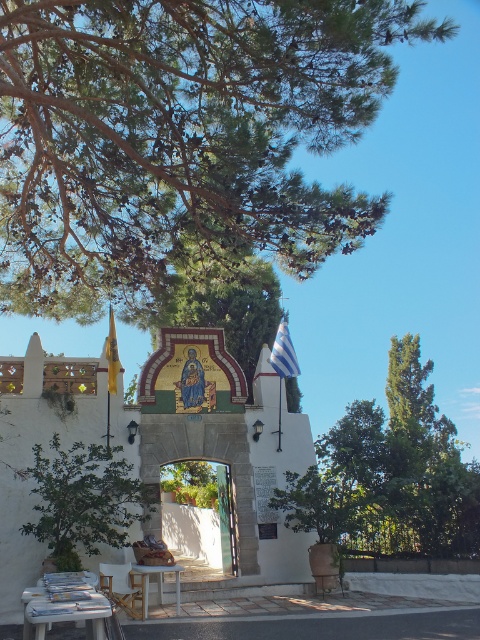
Question: In this image, where is gold mosaic chapel at center located relative to white fabric flag at center?

Choices:
 (A) above
 (B) below

Answer: (B)

Question: Which object appears farthest from the camera in this image?

Choices:
 (A) green leafy tree at right
 (B) white plastic picnic table at lower center
 (C) gold mosaic archway at center
 (D) blue striped flag at upper right

Answer: (C)

Question: Which point appears farthest from the camera in this image?

Choices:
 (A) (324, 243)
 (B) (291, 356)

Answer: (B)

Question: Can you confirm if green leafy tree at left is positioned above gold mosaic archway at center?

Choices:
 (A) no
 (B) yes

Answer: (B)

Question: Can you confirm if gold mosaic archway at center is bigger than white plastic picnic table at lower center?

Choices:
 (A) yes
 (B) no

Answer: (A)

Question: Which point appears closest to the camera in this image?

Choices:
 (A) (66, 593)
 (B) (106, 339)
 (C) (212, 566)

Answer: (A)